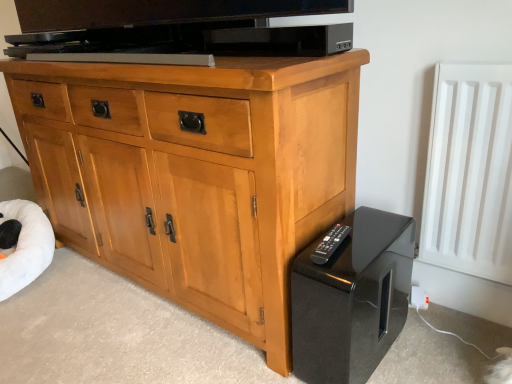
Find the location of `free point to the right of black glossy speaker at lower right`. free point to the right of black glossy speaker at lower right is located at coordinates (430, 349).